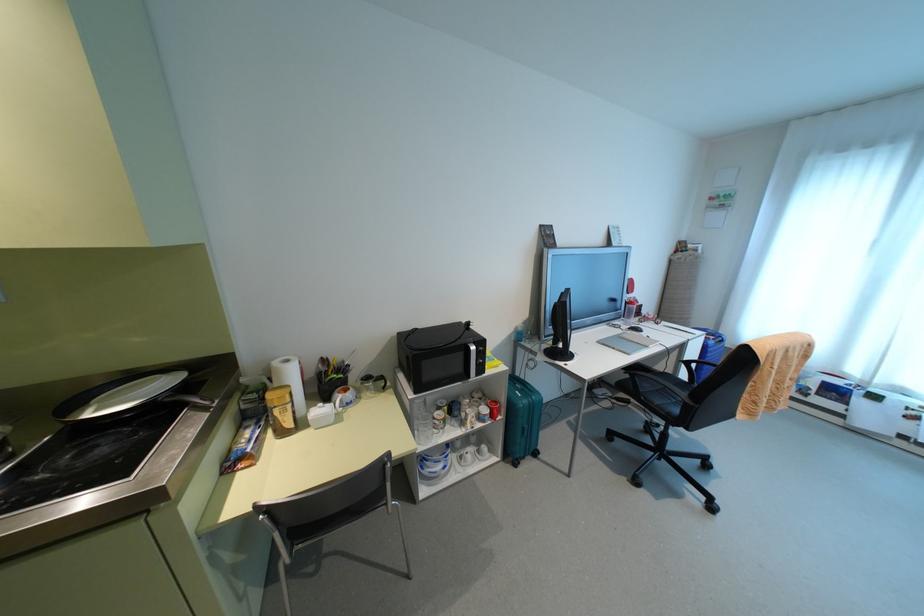
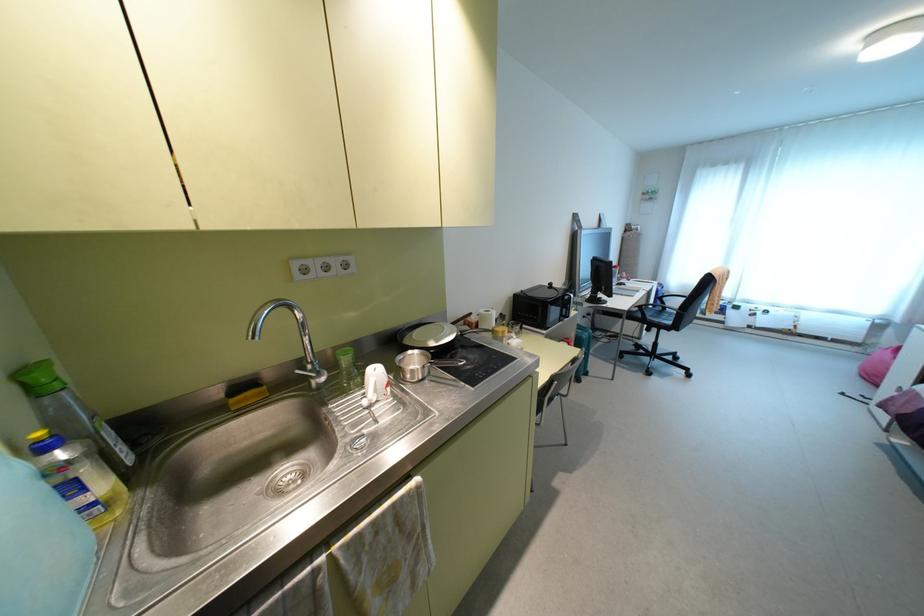
Find the pixel in the second image that matches point (95, 410) in the first image.

(435, 341)